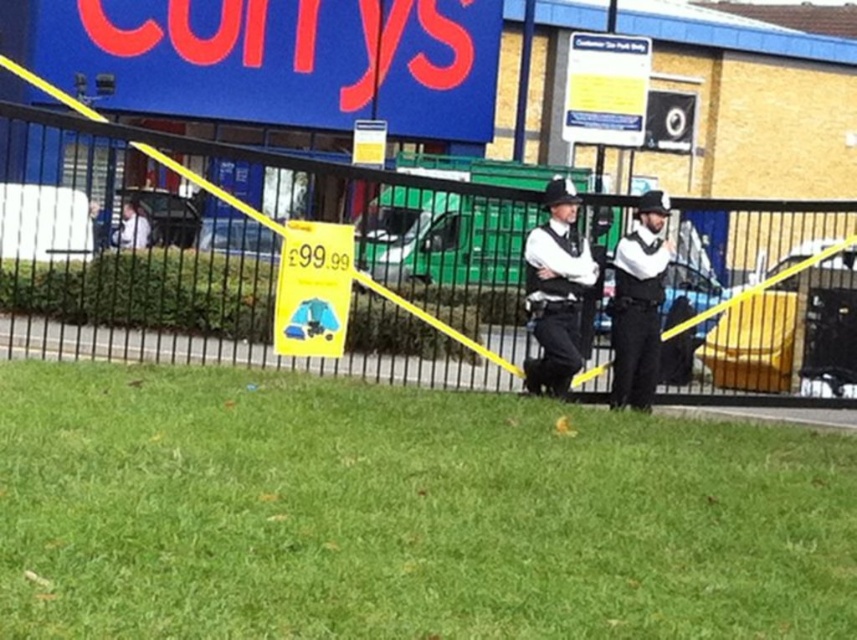
Question: Which of the following is the closest to the observer?

Choices:
 (A) (616, 378)
 (B) (61, 202)
 (C) (535, 292)

Answer: (C)

Question: Which point is farther to the camera?

Choices:
 (A) black metal fence at center
 (B) white uniformed officer at center
 (C) white uniform at center

Answer: (B)

Question: Observing the image, what is the correct spatial positioning of black metal fence at center in reference to white uniform at center?

Choices:
 (A) above
 (B) below

Answer: (A)

Question: Does black metal fence at center appear over white uniformed officer at center?

Choices:
 (A) yes
 (B) no

Answer: (A)

Question: Observing the image, what is the correct spatial positioning of black metal fence at center in reference to white uniformed officer at center?

Choices:
 (A) below
 (B) above

Answer: (B)

Question: Considering the real-world distances, which object is farthest from the white uniform at center?

Choices:
 (A) black metal fence at center
 (B) white uniformed officer at center

Answer: (A)